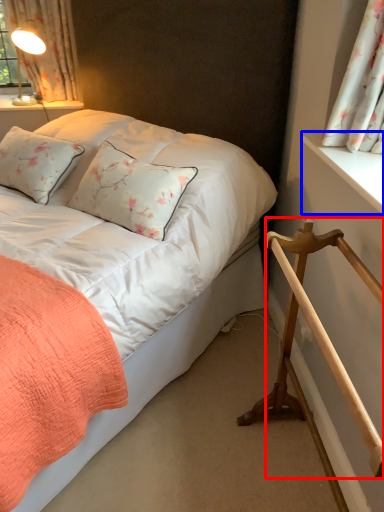
Question: Which object is closer to the camera taking this photo, rail (highlighted by a red box) or window sill (highlighted by a blue box)?

Choices:
 (A) rail
 (B) window sill

Answer: (A)